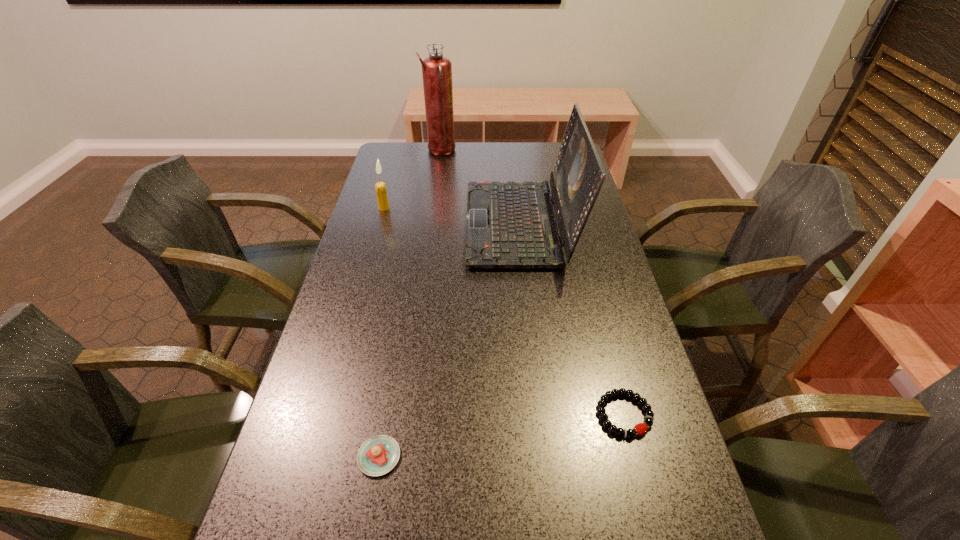
Locate an element on the screen. This screenshot has width=960, height=540. object positioned at the far left corner is located at coordinates (436, 69).

At what (x,y) coordinates should I click in order to perform the action: click on vacant position at the far edge of the desktop. Please return your answer as a coordinate pair (x, y). Looking at the image, I should click on (457, 151).

This screenshot has width=960, height=540. I want to click on free space at the left edge of the desktop, so click(310, 421).

The image size is (960, 540). Find the location of `blank space at the right edge of the desktop`. blank space at the right edge of the desktop is located at coordinates (606, 253).

Locate an element on the screen. Image resolution: width=960 pixels, height=540 pixels. vacant space at the far right corner is located at coordinates (545, 165).

Where is `free area in between the pastry and the second tallest object`? This screenshot has width=960, height=540. free area in between the pastry and the second tallest object is located at coordinates (450, 340).

Identify the location of free space between the pastry and the second tallest object. (450, 340).

You are a GUI agent. You are given a task and a screenshot of the screen. Output one action in this format:
    pyautogui.click(x=<x>, y=<y>)
    Task: Click on the free area in between the bracelet and the fire extinguisher
    This screenshot has height=540, width=960.
    Given the screenshot: What is the action you would take?
    pyautogui.click(x=532, y=283)

You are a GUI agent. You are given a task and a screenshot of the screen. Output one action in this format:
    pyautogui.click(x=<x>, y=<y>)
    Task: Click on the empty location between the second tallest object and the second shortest object
    
    Given the screenshot: What is the action you would take?
    pyautogui.click(x=450, y=340)

The width and height of the screenshot is (960, 540). Find the location of `free space between the pastry and the shortest object`. free space between the pastry and the shortest object is located at coordinates (502, 435).